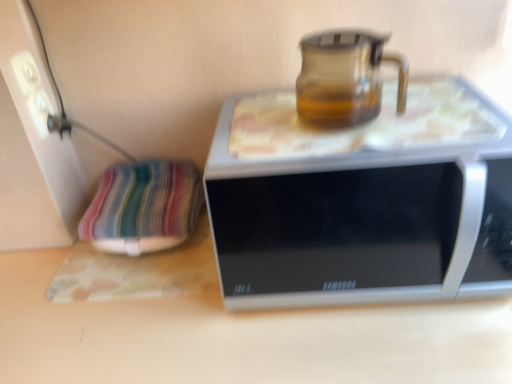
Question: Is smooth wooden table at center oriented away from transparent glass jug at upper center?

Choices:
 (A) yes
 (B) no

Answer: (B)

Question: From a real-world perspective, is smooth wooden table at center beneath transparent glass jug at upper center?

Choices:
 (A) yes
 (B) no

Answer: (A)

Question: Is smooth wooden table at center oriented towards transparent glass jug at upper center?

Choices:
 (A) no
 (B) yes

Answer: (A)

Question: Considering the relative sizes of smooth wooden table at center and transparent glass jug at upper center in the image provided, is smooth wooden table at center wider than transparent glass jug at upper center?

Choices:
 (A) yes
 (B) no

Answer: (A)

Question: Can you confirm if smooth wooden table at center is bigger than transparent glass jug at upper center?

Choices:
 (A) yes
 (B) no

Answer: (A)

Question: Is transparent glass jug at upper center bigger or smaller than striped fabric pillow at left?

Choices:
 (A) big
 (B) small

Answer: (B)

Question: Considering the positions of point (346, 56) and point (117, 182), is point (346, 56) closer or farther from the camera than point (117, 182)?

Choices:
 (A) closer
 (B) farther

Answer: (A)

Question: Looking at their shapes, would you say transparent glass jug at upper center is wider or thinner than striped fabric pillow at left?

Choices:
 (A) wide
 (B) thin

Answer: (B)

Question: Is transparent glass jug at upper center situated inside striped fabric pillow at left or outside?

Choices:
 (A) outside
 (B) inside

Answer: (A)

Question: Is point (338, 162) positioned closer to the camera than point (358, 100)?

Choices:
 (A) closer
 (B) farther

Answer: (A)

Question: From the image's perspective, is silver metallic microwave at center located above or below transparent glass jug at upper center?

Choices:
 (A) below
 (B) above

Answer: (A)

Question: From their relative heights in the image, would you say silver metallic microwave at center is taller or shorter than transparent glass jug at upper center?

Choices:
 (A) tall
 (B) short

Answer: (A)

Question: Based on their sizes in the image, would you say silver metallic microwave at center is bigger or smaller than transparent glass jug at upper center?

Choices:
 (A) small
 (B) big

Answer: (B)

Question: From their relative heights in the image, would you say white plastic socket at upper left is taller or shorter than silver metallic microwave at center?

Choices:
 (A) short
 (B) tall

Answer: (A)

Question: Considering the positions of white plastic socket at upper left and silver metallic microwave at center in the image, is white plastic socket at upper left bigger or smaller than silver metallic microwave at center?

Choices:
 (A) big
 (B) small

Answer: (B)